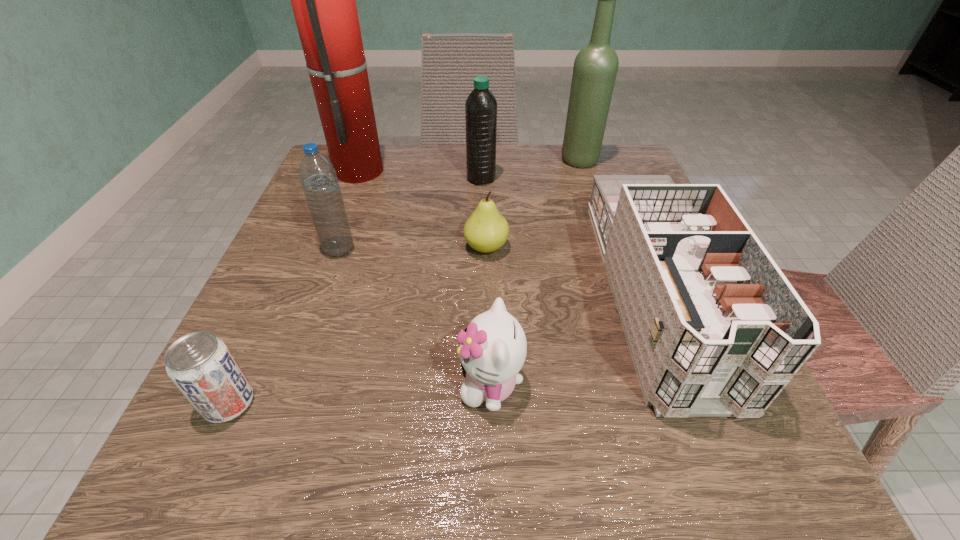
At what (x,y) coordinates should I click in order to perform the action: click on free space between the pear and the fire extinguisher. Please return your answer as a coordinate pair (x, y). The height and width of the screenshot is (540, 960). Looking at the image, I should click on (423, 208).

Where is `free space between the soda can and the fifth tallest object`? Image resolution: width=960 pixels, height=540 pixels. free space between the soda can and the fifth tallest object is located at coordinates (442, 347).

Image resolution: width=960 pixels, height=540 pixels. Find the location of `free space between the pear and the soda can`. free space between the pear and the soda can is located at coordinates (357, 325).

The image size is (960, 540). Find the location of `blank region between the kitten and the soda can`. blank region between the kitten and the soda can is located at coordinates (360, 394).

Locate an element on the screen. This screenshot has width=960, height=540. free point between the nearer water bottle and the pear is located at coordinates (413, 248).

The height and width of the screenshot is (540, 960). I want to click on vacant area that lies between the tallest object and the soda can, so click(295, 286).

I want to click on vacant area between the left water bottle and the seventh shortest object, so click(459, 205).

Identify which object is the fifth closest to the fourth shortest object. Please provide its 2D coordinates. Your answer should be formatted as a tuple, i.e. [(x, y)], where the tuple contains the x and y coordinates of a point satisfying the conditions above.

[(323, 0)]

Identify which object is the sixth nearest to the right water bottle. Please provide its 2D coordinates. Your answer should be formatted as a tuple, i.e. [(x, y)], where the tuple contains the x and y coordinates of a point satisfying the conditions above.

[(493, 348)]

Locate an element on the screen. The height and width of the screenshot is (540, 960). vacant space that satisfies the following two spatial constraints: 1. on the back side of the wine bottle; 2. on the right side of the pear is located at coordinates (485, 160).